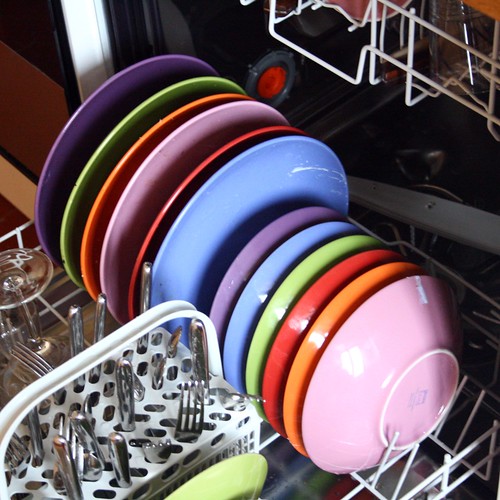
Image resolution: width=500 pixels, height=500 pixels. I want to click on utensil handles, so click(146, 284), click(104, 313), click(77, 324), click(202, 354), click(120, 456), click(126, 385), click(65, 461).